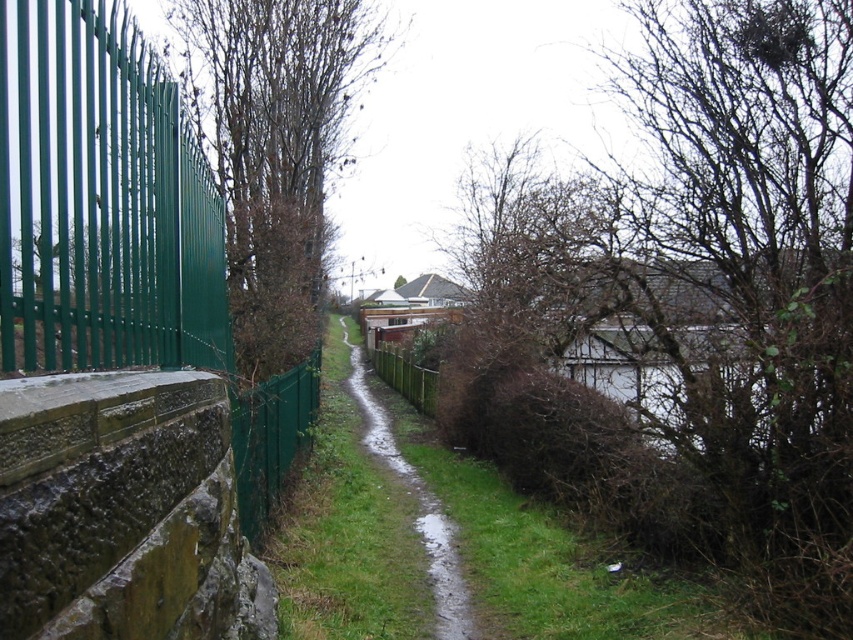
You are standing at the point marked as point (76, 232) on the path. You want to walk to the nearest house. The path is 2.30 meters wide. Can you walk straight ahead without stepping off the path?

The path is 2.30 meters wide, so if you walk straight ahead from point (76, 232), you can stay within the path as long as you remain within the 2.30 meter width. However, the question mentions the distance between the point and the viewer is 2.30 meters, which might indicate the path width. To clarify, since the path is narrow and flanked by fencing and shrubs, walking straight ahead should keep you on the path towards the houses.

You are standing at the point marked as point (122, 230) in the image. What object is located at that point?

The point (122, 230) indicates the green metal fence at left.

You are a gardener who needs to mow the lawn. You see the green grass at center and the wet grass at center. Which area should you avoid mowing first?

You should avoid mowing the wet grass at center first because it is currently wet, making it unsuitable for mowing until it dries.